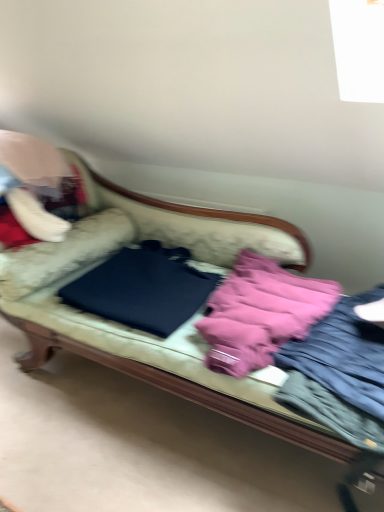
Question: Would you say velvet fabric couch at center is inside or outside pink fabric jacket at right?

Choices:
 (A) inside
 (B) outside

Answer: (B)

Question: In terms of height, does velvet fabric couch at center look taller or shorter compared to pink fabric jacket at right?

Choices:
 (A) tall
 (B) short

Answer: (A)

Question: Which object is the farthest from the pink fabric jacket at right?

Choices:
 (A) pink fabric at center
 (B) black matte laptop at center
 (C) velvet fabric couch at center

Answer: (B)

Question: Which object is positioned closest to the black matte laptop at center?

Choices:
 (A) pink fabric jacket at right
 (B) velvet fabric couch at center
 (C) pink fabric at center

Answer: (B)